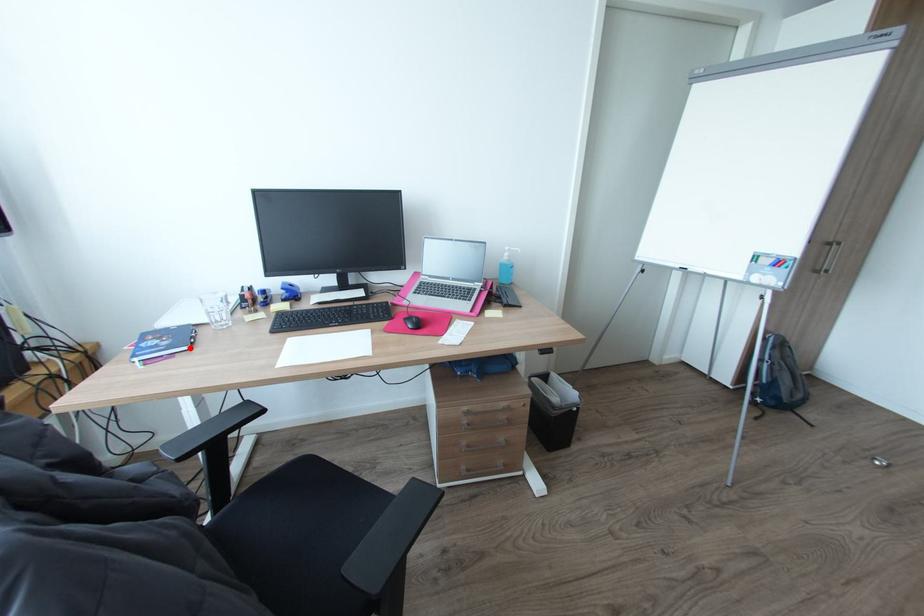
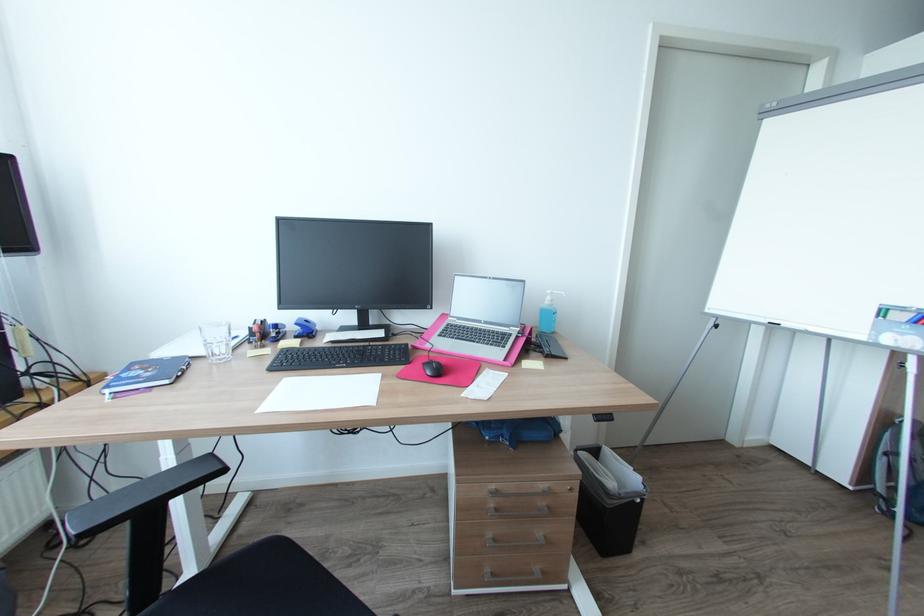
Locate, in the second image, the point that corresponds to the highlighted location in the first image.

(171, 381)